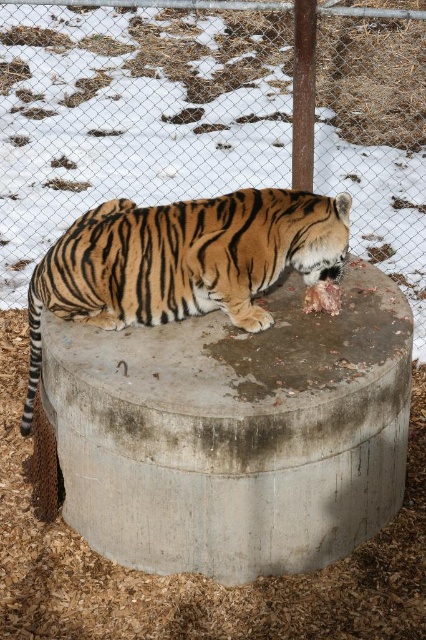
Who is lower down, gray concrete at center or orange-brown striped tiger at center?

gray concrete at center

This screenshot has height=640, width=426. Describe the element at coordinates (235, 433) in the screenshot. I see `gray concrete at center` at that location.

Who is more distant from viewer, (72, 340) or (129, 227)?

The point (129, 227) is behind.

Find the location of `gray concrete at center`. gray concrete at center is located at coordinates (235, 433).

Between metal mesh fence at upper center and gray concrete at center, which one appears on the left side from the viewer's perspective?

metal mesh fence at upper center

The height and width of the screenshot is (640, 426). In order to click on metal mesh fence at upper center in this screenshot , I will do `click(212, 116)`.

Which is above, metal mesh fence at upper center or orange-brown striped tiger at center?

metal mesh fence at upper center is above.

Which is in front, point (382, 192) or point (216, 212)?

Point (216, 212)

Find the location of `metal mesh fence at upper center`. metal mesh fence at upper center is located at coordinates (212, 116).